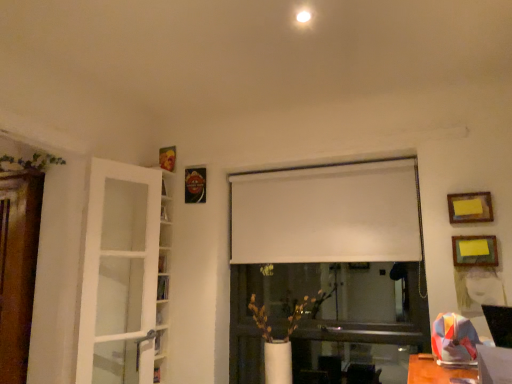
Question: Is yellow paper at upper right, arranged as the 2th picture frame when viewed from the top, smaller than green leafy plant at upper left, which ranks as the first plant in left-to-right order?

Choices:
 (A) no
 (B) yes

Answer: (B)

Question: From a real-world perspective, is yellow paper at upper right, arranged as the 2th picture frame when viewed from the top, positioned under green leafy plant at upper left, which ranks as the first plant in left-to-right order, based on gravity?

Choices:
 (A) no
 (B) yes

Answer: (B)

Question: From the image's perspective, is yellow paper at upper right, which is the 1th picture frame from bottom to top, under green leafy plant at upper left, acting as the second plant starting from the bottom?

Choices:
 (A) no
 (B) yes

Answer: (B)

Question: Is yellow paper at upper right, arranged as the 2th picture frame when viewed from the top, oriented towards green leafy plant at upper left, which ranks as the first plant in left-to-right order?

Choices:
 (A) no
 (B) yes

Answer: (A)

Question: Is green leafy plant at upper left, which ranks as the first plant in left-to-right order, at the back of yellow paper at upper right, which is the 1th picture frame from bottom to top?

Choices:
 (A) yes
 (B) no

Answer: (B)

Question: Visually, is yellow paper at upper right, arranged as the 2th picture frame when viewed from the top, positioned to the left or to the right of yellow paper at upper right, the 1th picture frame when ordered from top to bottom?

Choices:
 (A) left
 (B) right

Answer: (B)

Question: From the image's perspective, is yellow paper at upper right, which is the 1th picture frame from bottom to top, positioned above or below yellow paper at upper right, which ranks as the 2th picture frame in bottom-to-top order?

Choices:
 (A) above
 (B) below

Answer: (B)

Question: Considering the positions of point (468, 241) and point (476, 210), is point (468, 241) closer or farther from the camera than point (476, 210)?

Choices:
 (A) closer
 (B) farther

Answer: (B)

Question: In terms of size, does yellow paper at upper right, which is the 1th picture frame from bottom to top, appear bigger or smaller than yellow paper at upper right, the 1th picture frame when ordered from top to bottom?

Choices:
 (A) small
 (B) big

Answer: (B)

Question: Is white matte vase at center, arranged as the 2th plant when viewed from the top, wider or thinner than green leafy plant at upper left, positioned as the second plant in right-to-left order?

Choices:
 (A) thin
 (B) wide

Answer: (B)

Question: Considering the positions of white matte vase at center, the first plant in the bottom-to-top sequence, and green leafy plant at upper left, which ranks as the first plant in left-to-right order, in the image, is white matte vase at center, the first plant in the bottom-to-top sequence, taller or shorter than green leafy plant at upper left, which ranks as the first plant in left-to-right order,?

Choices:
 (A) tall
 (B) short

Answer: (A)

Question: Is white matte vase at center, marked as the second plant in a left-to-right arrangement, spatially inside green leafy plant at upper left, which ranks as the first plant in left-to-right order, or outside of it?

Choices:
 (A) outside
 (B) inside

Answer: (A)

Question: From the image's perspective, is white matte vase at center, marked as the second plant in a left-to-right arrangement, located above or below green leafy plant at upper left, which ranks as the first plant in left-to-right order?

Choices:
 (A) above
 (B) below

Answer: (B)

Question: Is white matte curtain at center to the left or to the right of yellow paper at upper right, which is the 1th picture frame from bottom to top, in the image?

Choices:
 (A) left
 (B) right

Answer: (A)

Question: Is point (334, 192) positioned closer to the camera than point (467, 249)?

Choices:
 (A) closer
 (B) farther

Answer: (B)